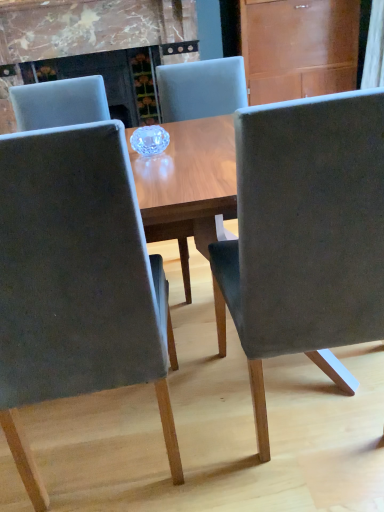
The width and height of the screenshot is (384, 512). Identify the location of velvet gray chair at center, placed as the third chair when sorted from right to left. (77, 281).

Image resolution: width=384 pixels, height=512 pixels. What do you see at coordinates (298, 35) in the screenshot?
I see `wooden at upper right` at bounding box center [298, 35].

You are a GUI agent. You are given a task and a screenshot of the screen. Output one action in this format:
    pyautogui.click(x=<x>, y=<y>)
    Task: Click on the suede-like gray chair at center, marked as the third chair in a left-to-right arrangement
    
    Given the screenshot: What is the action you would take?
    pyautogui.click(x=306, y=234)

Is suede-like gray chair at center, marked as the third chair in a left-to-right arrangement, facing towards suede-like gray chair at center, the second chair when ordered from left to right?

Yes.

Based on the photo, is suede-like gray chair at center, arranged as the 1th chair when viewed from the right, next to suede-like gray chair at center, placed as the 2th chair when sorted from right to left?

No, suede-like gray chair at center, arranged as the 1th chair when viewed from the right, is not next to suede-like gray chair at center, placed as the 2th chair when sorted from right to left.

From the image's perspective, which one is positioned lower, suede-like gray chair at center, arranged as the 1th chair when viewed from the right, or suede-like gray chair at center, placed as the 2th chair when sorted from right to left?

suede-like gray chair at center, arranged as the 1th chair when viewed from the right, is shown below in the image.

Is suede-like gray chair at center, marked as the third chair in a left-to-right arrangement, wider than suede-like gray chair at center, the second chair when ordered from left to right?

Incorrect, the width of suede-like gray chair at center, marked as the third chair in a left-to-right arrangement, does not surpass that of suede-like gray chair at center, the second chair when ordered from left to right.

Consider the image. Does wooden at upper right come in front of suede-like gray chair at center, placed as the 2th chair when sorted from right to left?

No, it is behind suede-like gray chair at center, placed as the 2th chair when sorted from right to left.

Considering the relative sizes of wooden at upper right and suede-like gray chair at center, placed as the 2th chair when sorted from right to left, in the image provided, is wooden at upper right smaller than suede-like gray chair at center, placed as the 2th chair when sorted from right to left,?

Incorrect, wooden at upper right is not smaller in size than suede-like gray chair at center, placed as the 2th chair when sorted from right to left.

In the scene shown: From the image's perspective, is wooden at upper right above suede-like gray chair at center, the second chair when ordered from left to right?

Correct, wooden at upper right appears higher than suede-like gray chair at center, the second chair when ordered from left to right, in the image.

From the wooden at upper right, count the 2nd chair to the left and point to it. Please provide its 2D coordinates.

[(201, 88)]

Based on their positions, is suede-like gray chair at center, placed as the 2th chair when sorted from right to left, located to the left or right of velvet gray chair at center, the first chair from the left?

suede-like gray chair at center, placed as the 2th chair when sorted from right to left, is to the right of velvet gray chair at center, the first chair from the left.

Considering the sizes of objects suede-like gray chair at center, placed as the 2th chair when sorted from right to left, and velvet gray chair at center, placed as the third chair when sorted from right to left, in the image provided, who is smaller, suede-like gray chair at center, placed as the 2th chair when sorted from right to left, or velvet gray chair at center, placed as the third chair when sorted from right to left,?

Smaller between the two is velvet gray chair at center, placed as the third chair when sorted from right to left.

Which is in front, point (236, 103) or point (103, 306)?

The point (103, 306) is closer.

Considering the positions of objects suede-like gray chair at center, placed as the 2th chair when sorted from right to left, and velvet gray chair at center, placed as the third chair when sorted from right to left, in the image provided, who is behind, suede-like gray chair at center, placed as the 2th chair when sorted from right to left, or velvet gray chair at center, placed as the third chair when sorted from right to left,?

suede-like gray chair at center, placed as the 2th chair when sorted from right to left, is more distant.

Is wooden at upper right outside of velvet gray chair at center, the first chair from the left?

Yes.

Which object is thinner, wooden at upper right or velvet gray chair at center, placed as the third chair when sorted from right to left?

wooden at upper right.

Where is `drawer lying above the velvet gray chair at center, placed as the third chair when sorted from right to left (from the image's perspective)`? The image size is (384, 512). drawer lying above the velvet gray chair at center, placed as the third chair when sorted from right to left (from the image's perspective) is located at coordinates (298, 35).

Considering the positions of objects wooden at upper right and velvet gray chair at center, placed as the third chair when sorted from right to left, in the image provided, who is more to the right, wooden at upper right or velvet gray chair at center, placed as the third chair when sorted from right to left,?

From the viewer's perspective, wooden at upper right appears more on the right side.

From a real-world perspective, between velvet gray chair at center, the first chair from the left, and suede-like gray chair at center, marked as the third chair in a left-to-right arrangement, who is vertically higher?

velvet gray chair at center, the first chair from the left, from a real-world perspective.

Is velvet gray chair at center, the first chair from the left, aimed at suede-like gray chair at center, marked as the third chair in a left-to-right arrangement?

No.

Based on the photo, which of these two, velvet gray chair at center, placed as the third chair when sorted from right to left, or suede-like gray chair at center, marked as the third chair in a left-to-right arrangement, stands shorter?

Standing shorter between the two is suede-like gray chair at center, marked as the third chair in a left-to-right arrangement.

Is velvet gray chair at center, placed as the third chair when sorted from right to left, touching suede-like gray chair at center, marked as the third chair in a left-to-right arrangement?

velvet gray chair at center, placed as the third chair when sorted from right to left, is not next to suede-like gray chair at center, marked as the third chair in a left-to-right arrangement, and they're not touching.

Is point (316, 155) closer or farther from the camera than point (74, 167)?

Point (316, 155) is farther from the camera than point (74, 167).

In the image, is suede-like gray chair at center, marked as the third chair in a left-to-right arrangement, on the left side or the right side of velvet gray chair at center, placed as the third chair when sorted from right to left?

Based on their positions, suede-like gray chair at center, marked as the third chair in a left-to-right arrangement, is located to the right of velvet gray chair at center, placed as the third chair when sorted from right to left.

Is suede-like gray chair at center, marked as the third chair in a left-to-right arrangement, closer to camera compared to velvet gray chair at center, the first chair from the left?

No, the depth of suede-like gray chair at center, marked as the third chair in a left-to-right arrangement, is greater than that of velvet gray chair at center, the first chair from the left.

Does suede-like gray chair at center, marked as the third chair in a left-to-right arrangement, turn towards velvet gray chair at center, the first chair from the left?

No, suede-like gray chair at center, marked as the third chair in a left-to-right arrangement, is not aimed at velvet gray chair at center, the first chair from the left.

Is suede-like gray chair at center, marked as the third chair in a left-to-right arrangement, turned away from wooden at upper right?

suede-like gray chair at center, marked as the third chair in a left-to-right arrangement, does not have its back to wooden at upper right.

From the image's perspective, which is above, suede-like gray chair at center, marked as the third chair in a left-to-right arrangement, or wooden at upper right?

From the image's view, wooden at upper right is above.

From the picture: Does suede-like gray chair at center, marked as the third chair in a left-to-right arrangement, have a lesser height compared to wooden at upper right?

No, suede-like gray chair at center, marked as the third chair in a left-to-right arrangement, is not shorter than wooden at upper right.

Locate an element on the screen. The width and height of the screenshot is (384, 512). chair that is the 2nd object directly below the wooden at upper right (from a real-world perspective) is located at coordinates (306, 234).

From the image's perspective, count 1st chairs downward from the suede-like gray chair at center, placed as the 2th chair when sorted from right to left, and point to it. Please provide its 2D coordinates.

[(306, 234)]

At what (x,y) coordinates should I click in order to perform the action: click on drawer that is on the right side of suede-like gray chair at center, placed as the 2th chair when sorted from right to left. Please return your answer as a coordinate pair (x, y). Looking at the image, I should click on (298, 35).

Considering their positions, is suede-like gray chair at center, placed as the 2th chair when sorted from right to left, positioned closer to velvet gray chair at center, the first chair from the left, than suede-like gray chair at center, marked as the third chair in a left-to-right arrangement?

suede-like gray chair at center, marked as the third chair in a left-to-right arrangement, is positioned closer to the anchor velvet gray chair at center, the first chair from the left.

Considering their positions, is velvet gray chair at center, placed as the third chair when sorted from right to left, positioned closer to suede-like gray chair at center, arranged as the 1th chair when viewed from the right, than wooden at upper right?

Among the two, velvet gray chair at center, placed as the third chair when sorted from right to left, is located nearer to suede-like gray chair at center, arranged as the 1th chair when viewed from the right.

Based on the photo, looking at the image, which one is located further to suede-like gray chair at center, arranged as the 1th chair when viewed from the right, velvet gray chair at center, placed as the third chair when sorted from right to left, or suede-like gray chair at center, placed as the 2th chair when sorted from right to left?

The object further to suede-like gray chair at center, arranged as the 1th chair when viewed from the right, is suede-like gray chair at center, placed as the 2th chair when sorted from right to left.

Considering their positions, is wooden at upper right positioned further to velvet gray chair at center, placed as the third chair when sorted from right to left, than suede-like gray chair at center, arranged as the 1th chair when viewed from the right?

wooden at upper right lies further to velvet gray chair at center, placed as the third chair when sorted from right to left, than the other object.

Considering their positions, is suede-like gray chair at center, arranged as the 1th chair when viewed from the right, positioned further to velvet gray chair at center, placed as the third chair when sorted from right to left, than wooden at upper right?

Among the two, wooden at upper right is located further to velvet gray chair at center, placed as the third chair when sorted from right to left.

When comparing their distances from suede-like gray chair at center, placed as the 2th chair when sorted from right to left, does suede-like gray chair at center, arranged as the 1th chair when viewed from the right, or velvet gray chair at center, the first chair from the left, seem further?

Based on the image, velvet gray chair at center, the first chair from the left, appears to be further to suede-like gray chair at center, placed as the 2th chair when sorted from right to left.

Considering their positions, is suede-like gray chair at center, arranged as the 1th chair when viewed from the right, positioned closer to wooden at upper right than velvet gray chair at center, placed as the third chair when sorted from right to left?

suede-like gray chair at center, arranged as the 1th chair when viewed from the right, lies closer to wooden at upper right than the other object.

Which object lies nearer to the anchor point velvet gray chair at center, placed as the third chair when sorted from right to left, suede-like gray chair at center, arranged as the 1th chair when viewed from the right, or suede-like gray chair at center, placed as the 2th chair when sorted from right to left?

Based on the image, suede-like gray chair at center, arranged as the 1th chair when viewed from the right, appears to be nearer to velvet gray chair at center, placed as the third chair when sorted from right to left.

Find the location of a particular element. The image size is (384, 512). chair positioned between suede-like gray chair at center, marked as the third chair in a left-to-right arrangement, and wooden at upper right from near to far is located at coordinates coord(201,88).

At what (x,y) coordinates should I click in order to perform the action: click on chair between velvet gray chair at center, the first chair from the left, and suede-like gray chair at center, the second chair when ordered from left to right, along the z-axis. Please return your answer as a coordinate pair (x, y). This screenshot has width=384, height=512. Looking at the image, I should click on (306, 234).